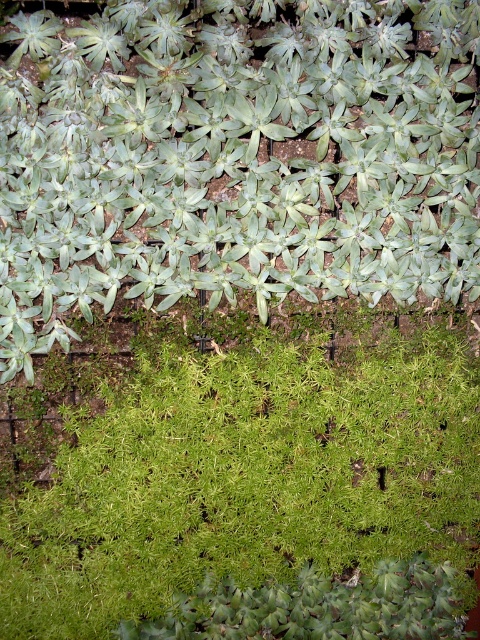
Question: Which object is closer to the camera taking this photo?

Choices:
 (A) green fuzzy moss at bottom
 (B) green leafy plant at upper center

Answer: (B)

Question: Does green leafy plant at upper center appear over green fuzzy moss at bottom?

Choices:
 (A) yes
 (B) no

Answer: (A)

Question: Does green leafy plant at upper center have a lesser width compared to green fuzzy moss at bottom?

Choices:
 (A) yes
 (B) no

Answer: (A)

Question: Is green leafy plant at upper center above green fuzzy moss at bottom?

Choices:
 (A) yes
 (B) no

Answer: (A)